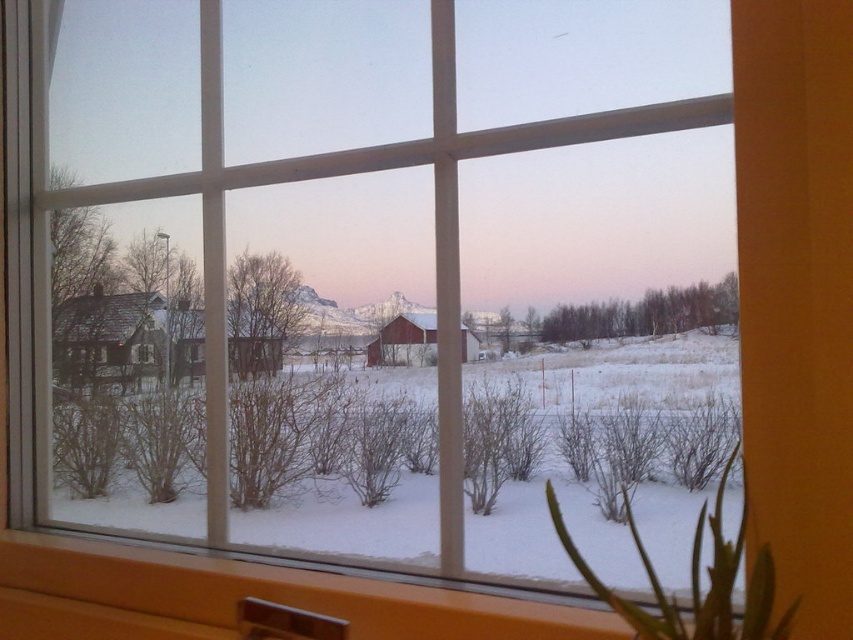
Is point (363, 374) positioned behind point (585, 564)?

Yes.

Can you confirm if white fluffy snow at center is bigger than green leafy plant at lower right?

Correct, white fluffy snow at center is larger in size than green leafy plant at lower right.

Which is behind, point (294, 380) or point (564, 529)?

The point (294, 380) is more distant.

Where is `white fluffy snow at center`? white fluffy snow at center is located at coordinates (596, 456).